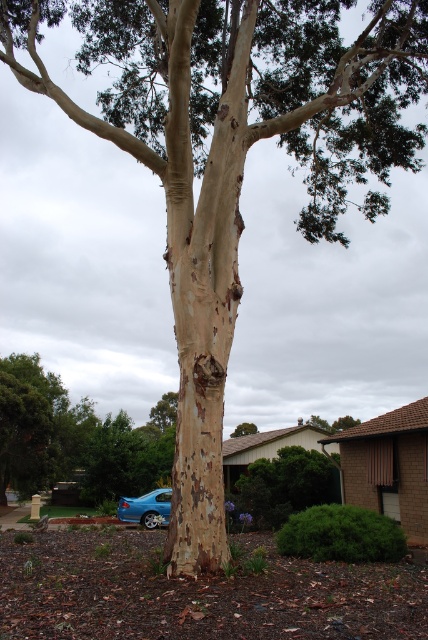
You are standing at the center of the image and want to move towards the blue metallic sedan at lower left. Which direction should you move in?

You should move towards the lower left direction to reach the blue metallic sedan at lower left.

You are standing in front of the tree and want to determine the relative positions of two points marked in the scene. Which point is closer to you, point 1 at coordinates point (130,515) or point 2 at coordinates point (256,428)?

Point 1 at coordinates point (130,515) is closer to you than point 2 at coordinates point (256,428).

You are driving a car and want to park it in the driveway behind the house. There is a blue metallic sedan at lower left and a smooth bark tree at center in the scene. Which object is closer to the driveway entrance?

The blue metallic sedan at lower left is closer to the driveway entrance because it is positioned to the left of the smooth bark tree at center, which is closer to the house.